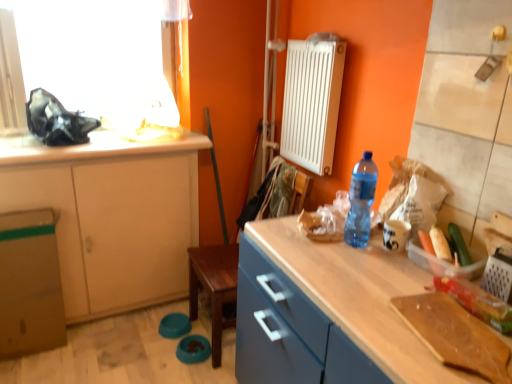
Question: Are green plastic bag at right, positioned as the 1th vegetable in bottom-to-top order, and translucent plastic container at right making contact?

Choices:
 (A) yes
 (B) no

Answer: (B)

Question: Can you confirm if green plastic bag at right, positioned as the 1th vegetable in bottom-to-top order, is thinner than translucent plastic container at right?

Choices:
 (A) no
 (B) yes

Answer: (A)

Question: From a real-world perspective, is green plastic bag at right, positioned as the 1th vegetable in bottom-to-top order, located higher than translucent plastic container at right?

Choices:
 (A) yes
 (B) no

Answer: (B)

Question: Can you confirm if green plastic bag at right, positioned as the 1th vegetable in bottom-to-top order, is taller than translucent plastic container at right?

Choices:
 (A) no
 (B) yes

Answer: (A)

Question: From the image's perspective, does green plastic bag at right, marked as the 2th vegetable in a back-to-front arrangement, appear higher than translucent plastic container at right?

Choices:
 (A) no
 (B) yes

Answer: (A)

Question: Is blue plastic bottle at right spatially inside green matte cucumber at right, the second vegetable when ordered from front to back, or outside of it?

Choices:
 (A) outside
 (B) inside

Answer: (A)

Question: Is blue plastic bottle at right in front of or behind green matte cucumber at right, placed as the 2th vegetable when sorted from bottom to top, in the image?

Choices:
 (A) front
 (B) behind

Answer: (B)

Question: Is blue plastic bottle at right taller or shorter than green matte cucumber at right, the 1th vegetable positioned from the top?

Choices:
 (A) short
 (B) tall

Answer: (B)

Question: In terms of width, does blue plastic bottle at right look wider or thinner when compared to green matte cucumber at right, the second vegetable when ordered from front to back?

Choices:
 (A) thin
 (B) wide

Answer: (B)

Question: From a real-world perspective, is green matte cucumber at right, placed as the 2th vegetable when sorted from bottom to top, above or below matte wood cabinet at left?

Choices:
 (A) below
 (B) above

Answer: (B)

Question: From the image's perspective, is green matte cucumber at right, placed as the 2th vegetable when sorted from bottom to top, positioned above or below matte wood cabinet at left?

Choices:
 (A) below
 (B) above

Answer: (B)

Question: Do you think green matte cucumber at right, the second vegetable when ordered from front to back, is within matte wood cabinet at left, or outside of it?

Choices:
 (A) inside
 (B) outside

Answer: (B)

Question: In terms of width, does green matte cucumber at right, the 1th vegetable positioned from the top, look wider or thinner when compared to matte wood cabinet at left?

Choices:
 (A) wide
 (B) thin

Answer: (B)

Question: In the image, is white matte countertop at upper left positioned in front of or behind blue plastic bottle at right?

Choices:
 (A) behind
 (B) front

Answer: (A)

Question: In the image, is white matte countertop at upper left on the left side or the right side of blue plastic bottle at right?

Choices:
 (A) right
 (B) left

Answer: (B)